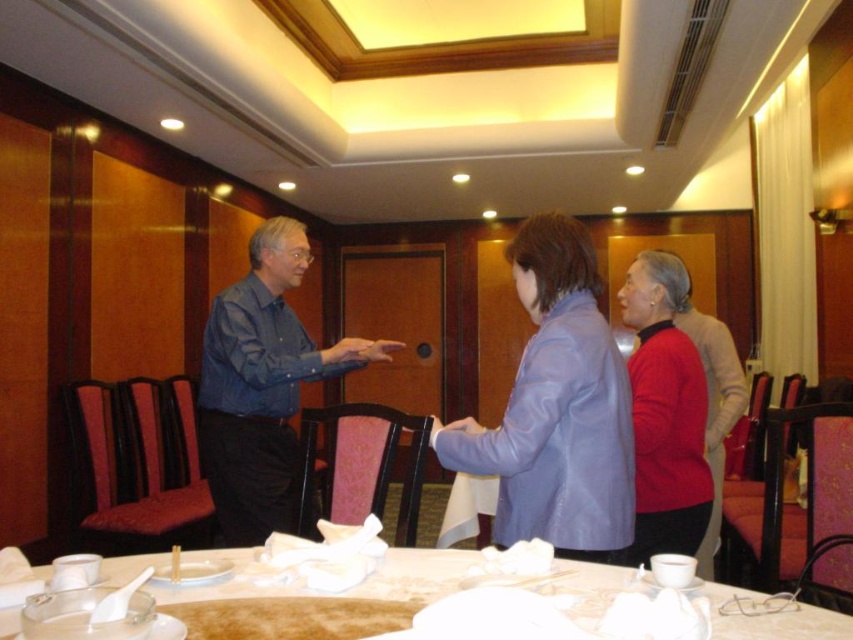
Between point (700, 419) and point (483, 356), which one is positioned in front?

Point (700, 419) is more forward.

In order to click on matte red sweater at center in this screenshot , I will do `click(665, 412)`.

Which is below, matte red sweater at center or white fabric table at lower center?

Positioned lower is white fabric table at lower center.

Can you confirm if matte red sweater at center is positioned above white fabric table at lower center?

Correct, matte red sweater at center is located above white fabric table at lower center.

Where is `matte red sweater at center`? Image resolution: width=853 pixels, height=640 pixels. matte red sweater at center is located at coordinates (665, 412).

Where is `matte red sweater at center`? Image resolution: width=853 pixels, height=640 pixels. matte red sweater at center is located at coordinates (665, 412).

Is white fabric table at lower center further to the viewer compared to purple leather jacket at center?

No, it is not.

Does white fabric table at lower center appear over purple leather jacket at center?

Incorrect, white fabric table at lower center is not positioned above purple leather jacket at center.

Describe the element at coordinates (415, 573) in the screenshot. Image resolution: width=853 pixels, height=640 pixels. I see `white fabric table at lower center` at that location.

This screenshot has height=640, width=853. What are the coordinates of `white fabric table at lower center` in the screenshot? It's located at (415, 573).